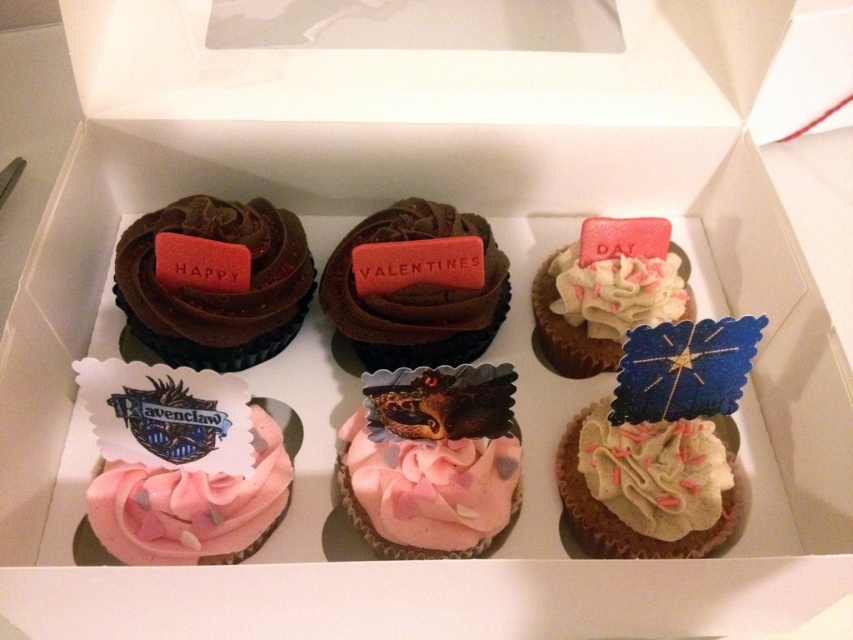
From the picture: You are a baker who needs to place a new cupcake between the pink frosted cupcake at lower left and the white frosted cupcake with sprinkles at center. The new cupcake has a diameter of 3 inches. Is there enough space between them to fit the new cupcake?

The distance between the pink frosted cupcake at lower left and the white frosted cupcake with sprinkles at center is 19.46 inches. Since the new cupcake has a diameter of 3 inches, there is sufficient space to place it between them.